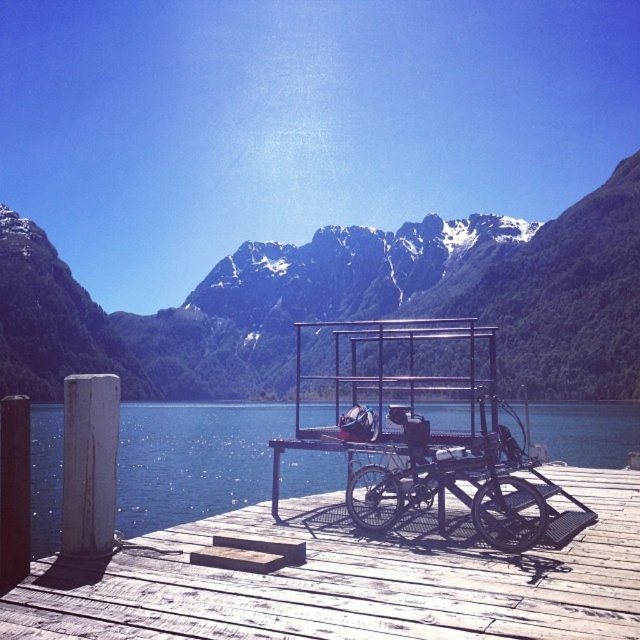
Can you confirm if wooden dock at center is smaller than blue water at center?

Correct, wooden dock at center occupies less space than blue water at center.

Between wooden dock at center and blue water at center, which one is positioned higher?

wooden dock at center is higher up.

Does point (240, 620) come farther from viewer compared to point (49, 548)?

No, it is not.

Locate an element on the screen. Image resolution: width=640 pixels, height=640 pixels. wooden dock at center is located at coordinates (353, 580).

How distant is wooden dock at center from black matte bicycle at center?

wooden dock at center is 6.50 meters from black matte bicycle at center.

Can you confirm if wooden dock at center is positioned above black matte bicycle at center?

Actually, wooden dock at center is below black matte bicycle at center.

The image size is (640, 640). I want to click on wooden dock at center, so click(x=353, y=580).

This screenshot has height=640, width=640. What are the coordinates of `wooden dock at center` in the screenshot? It's located at (353, 580).

Find the location of a particular element. The image size is (640, 640). blue water at center is located at coordinates (193, 460).

Is blue water at center thinner than black matte bicycle at center?

No.

Measure the distance between blue water at center and camera.

The distance of blue water at center from camera is 58.79 meters.

At what (x,y) coordinates should I click in order to perform the action: click on blue water at center. Please return your answer as a coordinate pair (x, y). Looking at the image, I should click on (193, 460).